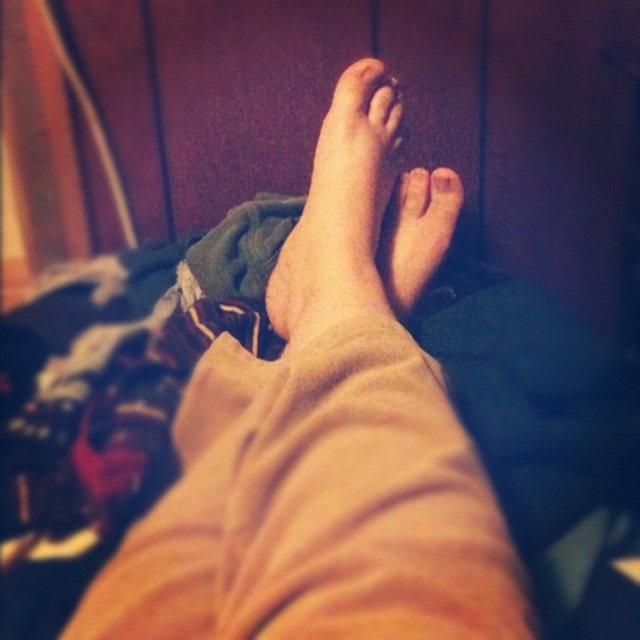
Question: Can you confirm if skinny beige foot at center is positioned below matte skin toe at upper center?

Choices:
 (A) yes
 (B) no

Answer: (A)

Question: Is skinny beige foot at center above matte skin toe at upper center?

Choices:
 (A) no
 (B) yes

Answer: (A)

Question: Which object appears closest to the camera in this image?

Choices:
 (A) smooth skin toe at center
 (B) skinny beige pants at center

Answer: (B)

Question: Considering the real-world distances, which object is closest to the smooth skin foot at center?

Choices:
 (A) skinny beige foot at center
 (B) matte skin toe at upper center
 (C) skinny beige pants at center

Answer: (A)

Question: Which of the following is the farthest from the observer?

Choices:
 (A) skinny beige pants at center
 (B) smooth skin foot at center
 (C) matte skin toe at center

Answer: (C)

Question: Is matte skin toe at upper center above smooth skin toe at center?

Choices:
 (A) no
 (B) yes

Answer: (B)